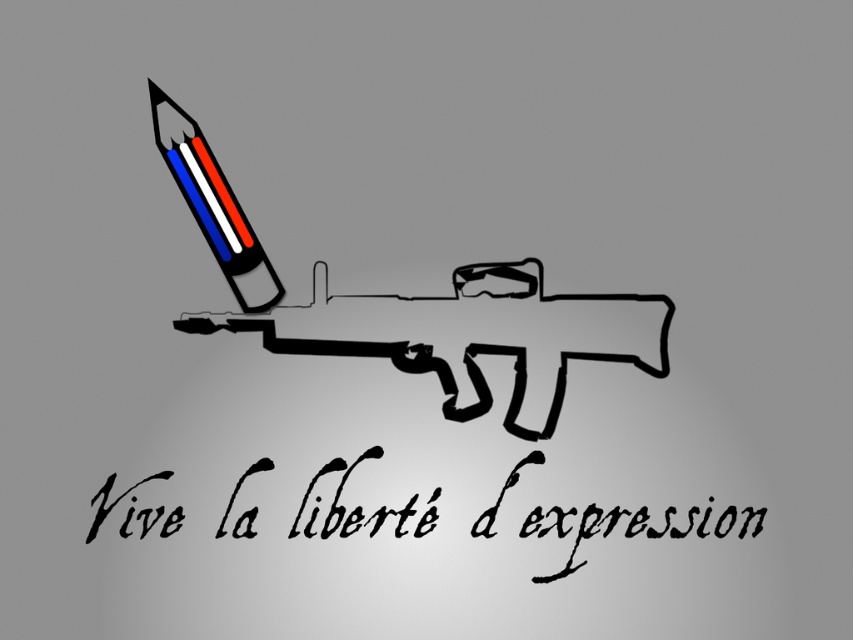
You are an art student analyzing the image. You notice the black calligraphy at lower center and the matte plastic pencil at upper left. Which object is taller in the image?

The matte plastic pencil at upper left is taller than the black calligraphy at lower center.

Based on the coordinates provided, where is the black calligraphy at lower center located in the image?

The black calligraphy at lower center is located at point coordinates of 0.823 on the x axis and 0.744 on the y axis.